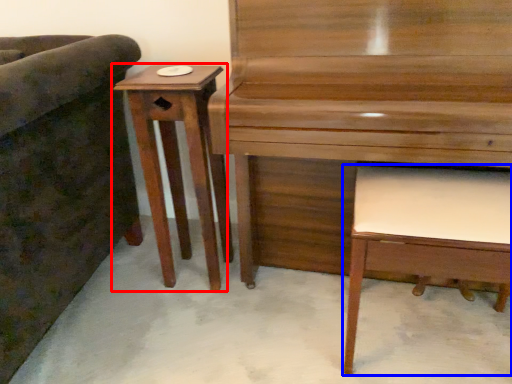
Question: Which object appears closest to the camera in this image, table (highlighted by a red box) or music stool (highlighted by a blue box)?

Choices:
 (A) table
 (B) music stool

Answer: (B)